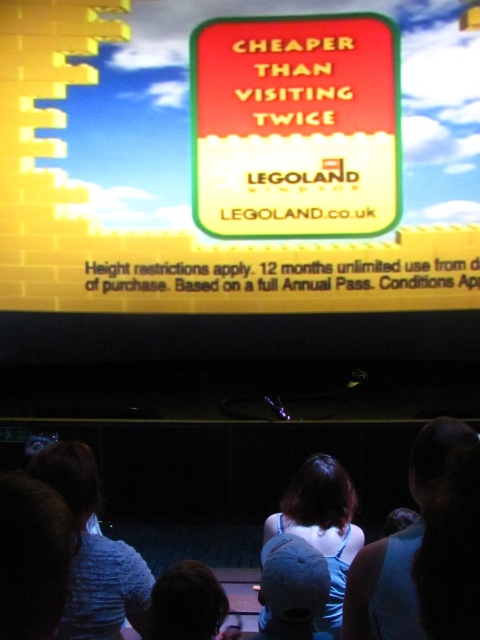
You are standing in front of the large screen displaying the Legoland Windsor advertisement. You notice two signs at the upper center of the screen. Which one is closer to you, the yellow matte sign at upper center or the red glossy sign at upper center?

The yellow matte sign at upper center is closer to the viewer than the red glossy sign at upper center.

You are a customer standing in front of the large screen displaying the Legoland Windsor advertisement. You notice two signs at the upper center of the screen. Which one is taller between the yellow matte sign at upper center and the red glossy sign at upper center?

The yellow matte sign at upper center is much taller than the red glossy sign at upper center according to the description.

You are standing in front of the Legoland Windsor advertisement screen. You need to reach both the light blue denim shirt at center and the dark blue fabric shirt at center to clean them. Given that your cleaning tool has a maximum reach of 10 feet, can you clean both shirts without moving your position?

The distance between the light blue denim shirt at center and the dark blue fabric shirt at center is 9.46 feet. Since your cleaning tool can reach up to 10 feet, you can clean both shirts from your current position without needing to move.